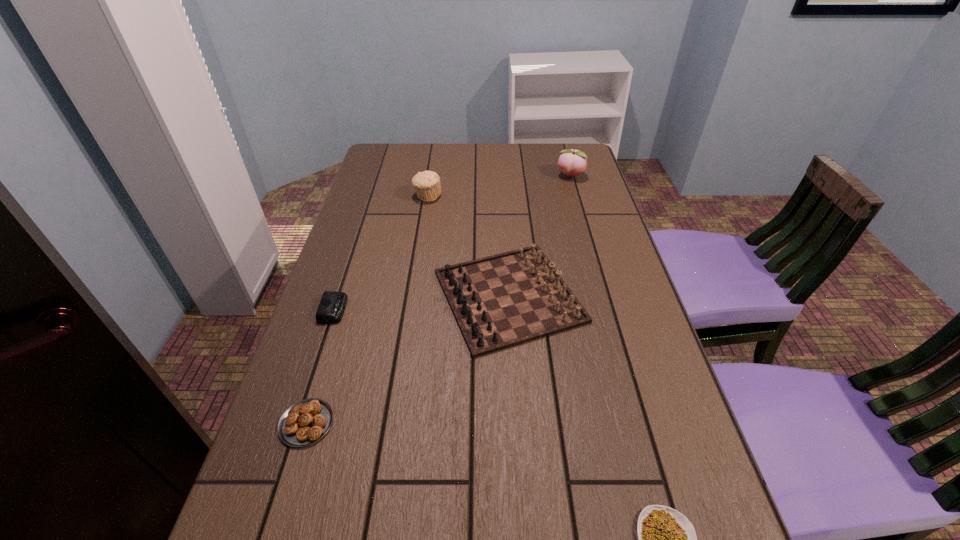
Image resolution: width=960 pixels, height=540 pixels. In order to click on vacant space that satisfies the following two spatial constraints: 1. on the display of the alarm clock; 2. on the left side of the fifth farthest object in this screenshot , I will do `click(296, 423)`.

You are a GUI agent. You are given a task and a screenshot of the screen. Output one action in this format:
    pyautogui.click(x=<x>, y=<y>)
    Task: Click on the vacant position in the image that satisfies the following two spatial constraints: 1. on the back side of the pastry; 2. on the display of the alarm clock
    Image resolution: width=960 pixels, height=540 pixels.
    Given the screenshot: What is the action you would take?
    pyautogui.click(x=342, y=309)